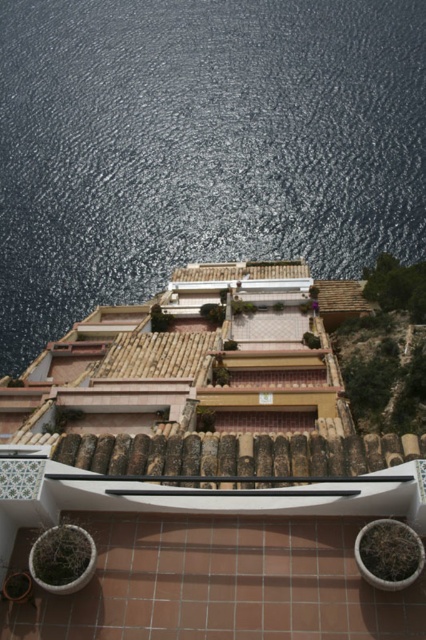
You are a photographer planning to take a wide shot of the coastal area. You want to ensure that the glistening water at upper center and the white glossy balcony at center are both visible in your frame. Given their sizes, which object will occupy more space in the photo?

The glistening water at upper center is bigger than the white glossy balcony at center, so it will occupy more space in the photo.

You are standing on the tiled balcony with a curved white railing and notice the glistening water at upper center. Based on its position at coordinates approximately 0.228 along the horizontal axis and 0.469 along the vertical axis, can you determine if the water is closer to the top or bottom of the image?

The glistening water at upper center is located at point (199, 145). Since the vertical coordinate 0.469 is closer to 0.5, which is the midpoint between the bottom and top of the image, it is positioned near the upper half of the image, making it closer to the top than the bottom.